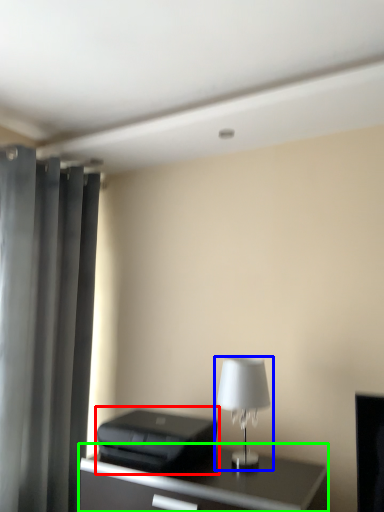
Question: Considering the real-world distances, which object is closest to printer (highlighted by a red box)? lamp (highlighted by a blue box) or table (highlighted by a green box).

Choices:
 (A) lamp
 (B) table

Answer: (B)